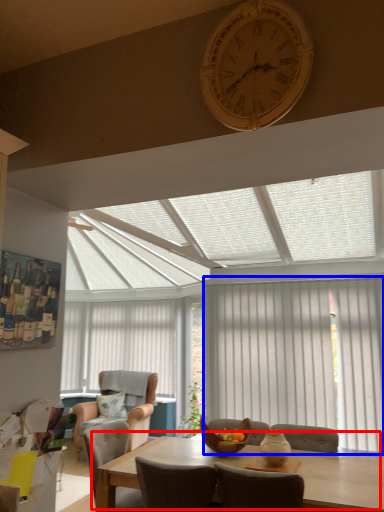
Question: Which of the following is the closest to the observer, kitchen & dining room table (highlighted by a red box) or curtain (highlighted by a blue box)?

Choices:
 (A) kitchen & dining room table
 (B) curtain

Answer: (A)